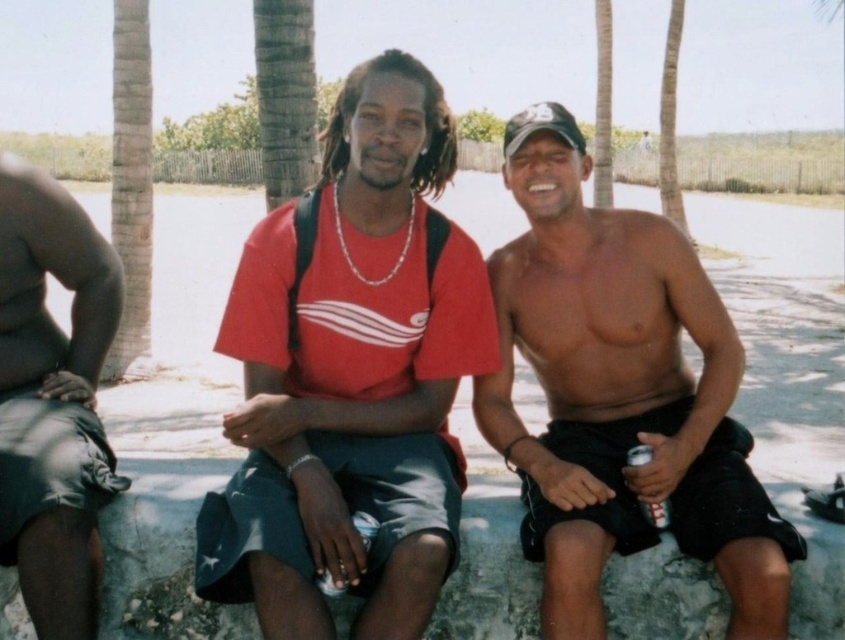
Question: Which object is the closest to the red matte shirt at center?

Choices:
 (A) dark gray shorts at left
 (B) shiny black shorts at center

Answer: (B)

Question: Which object is closer to the camera taking this photo?

Choices:
 (A) dark gray shorts at left
 (B) red matte shirt at center
 (C) shiny black shorts at center

Answer: (B)

Question: Which object is the farthest from the dark gray shorts at left?

Choices:
 (A) shiny black shorts at center
 (B) red matte shirt at center

Answer: (A)

Question: Does red matte shirt at center appear on the right side of shiny black shorts at center?

Choices:
 (A) no
 (B) yes

Answer: (A)

Question: Does shiny black shorts at center appear over dark gray shorts at left?

Choices:
 (A) no
 (B) yes

Answer: (B)

Question: Is red matte shirt at center thinner than shiny black shorts at center?

Choices:
 (A) no
 (B) yes

Answer: (A)